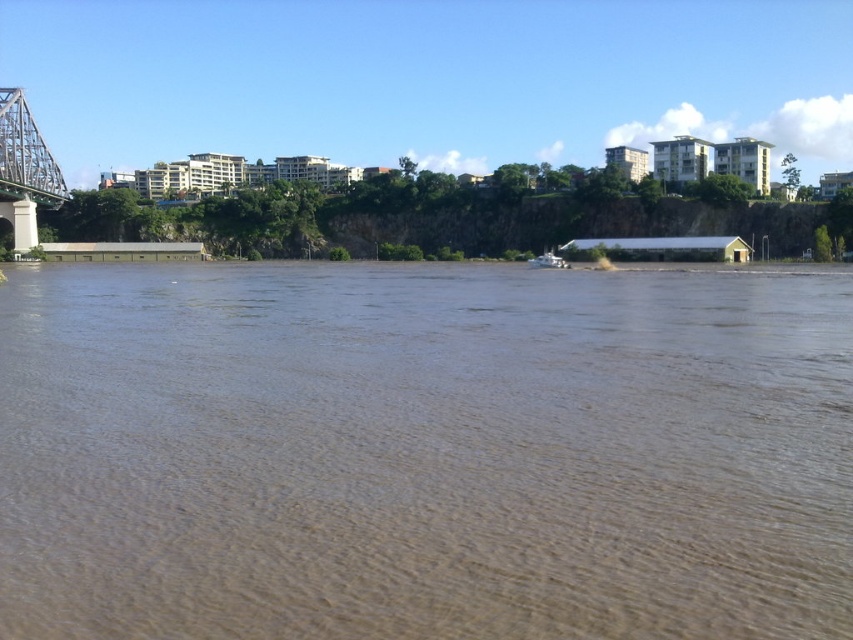
Who is more distant from viewer, (444, 404) or (10, 216)?

The point (10, 216) is more distant.

Who is more forward, (434, 412) or (42, 195)?

Positioned in front is point (434, 412).

In order to click on brown muddy water at center in this screenshot , I will do `click(422, 452)`.